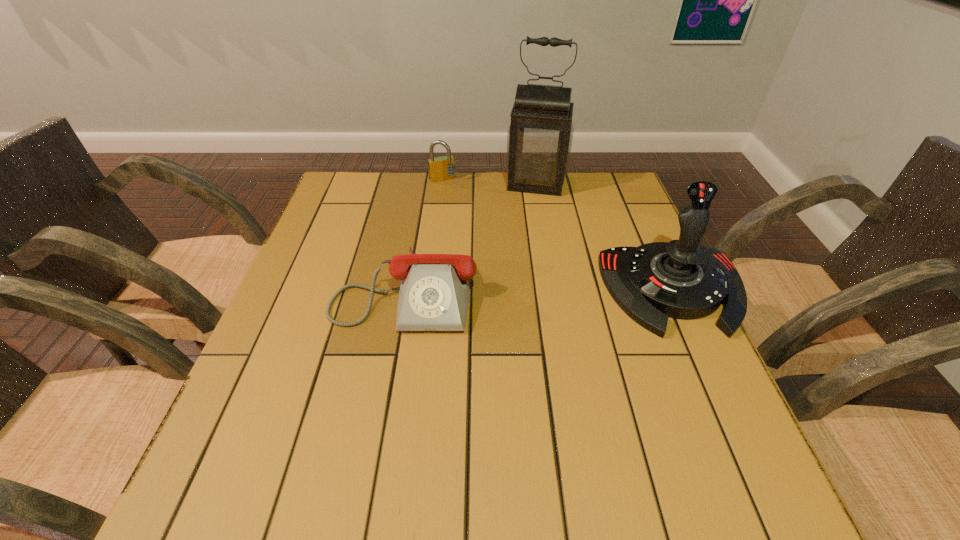
Image resolution: width=960 pixels, height=540 pixels. Find the location of `vacant space on the desktop that is between the telephone and the second tallest object and is positioned on the front-facing side of the lantern`. vacant space on the desktop that is between the telephone and the second tallest object and is positioned on the front-facing side of the lantern is located at coordinates (516, 289).

In order to click on vacant space on the desktop that is between the telephone and the rightmost object and is positioned on the side with the combination dials of the padlock in this screenshot , I will do `click(509, 289)`.